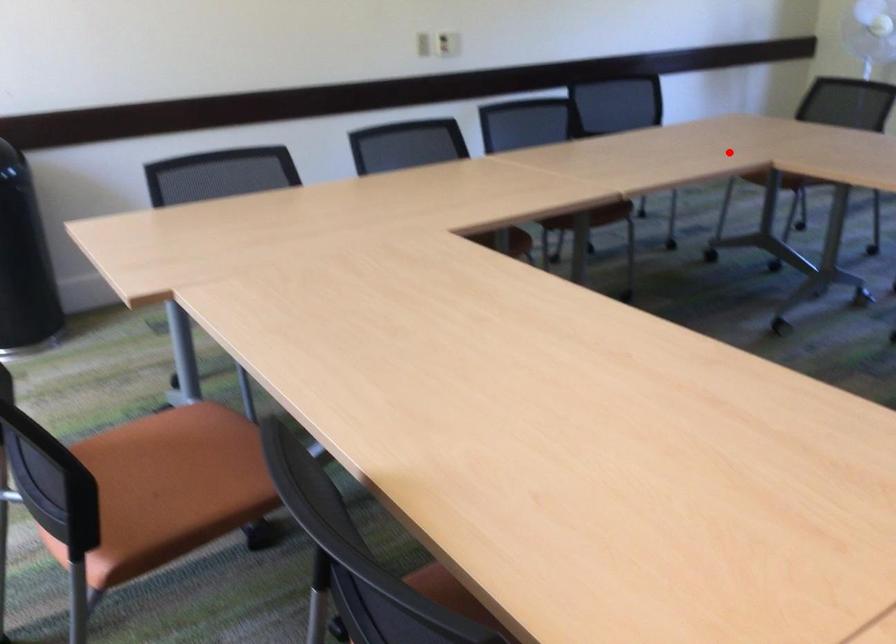
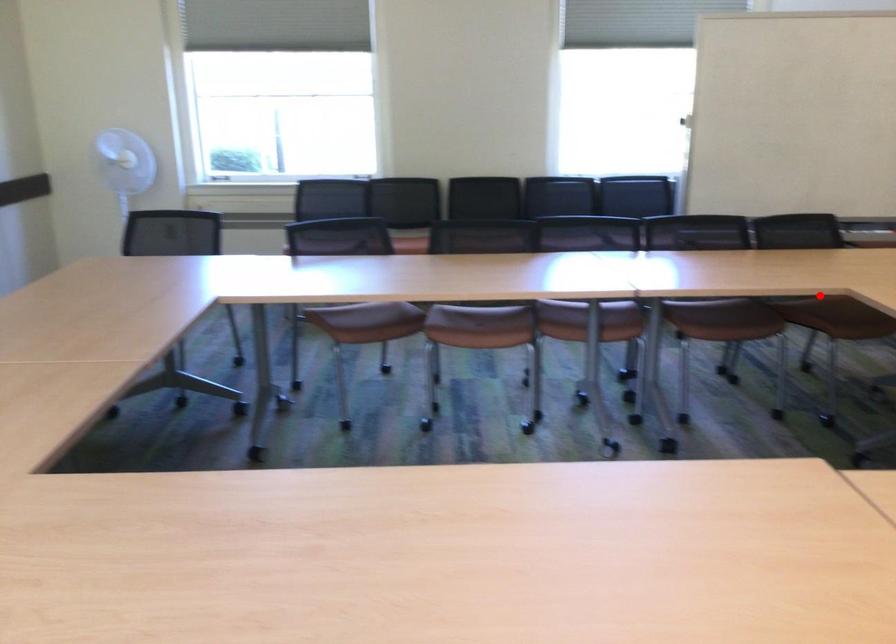
I am providing you with two images of the same scene from different viewpoints. A red point is marked on the first image and another point is marked on the second image. Do the highlighted points in image1 and image2 indicate the same real-world spot?

No